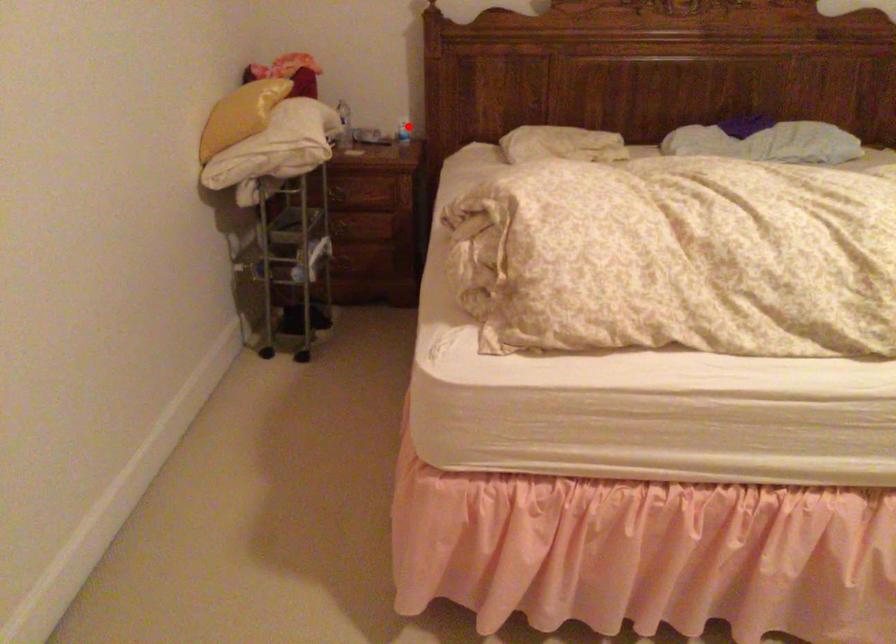
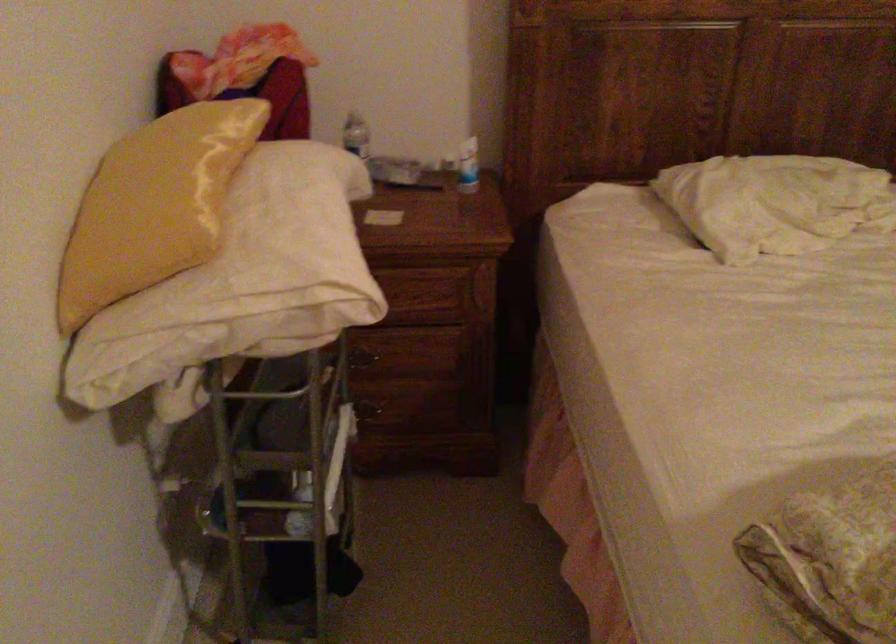
Question: I am providing you with two images of the same scene from different viewpoints. Image1 has a red point marked. In image2, the corresponding 3D location appears at what relative position? Reply with the corresponding letter.

Choices:
 (A) Closer
 (B) Farther

Answer: (A)